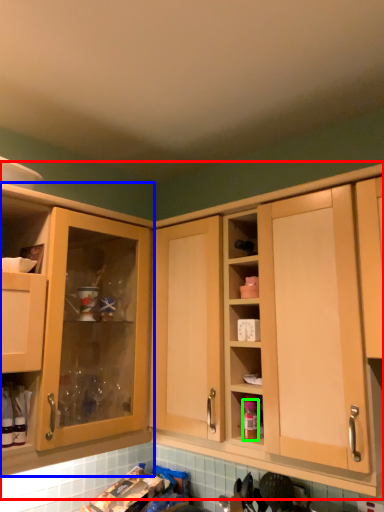
Question: Estimate the real-world distances between objects in this image. Which object is farther from cabinetry (highlighted by a red box), cabinetry (highlighted by a blue box) or bottle (highlighted by a green box)?

Choices:
 (A) cabinetry
 (B) bottle

Answer: (A)